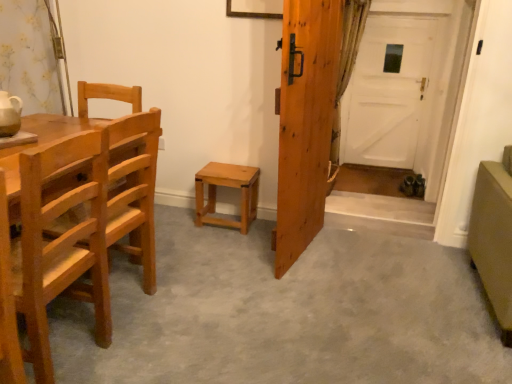
Identify the location of free location to the right of wooden door at center, which appears as the 2th door when viewed from the right. (370, 254).